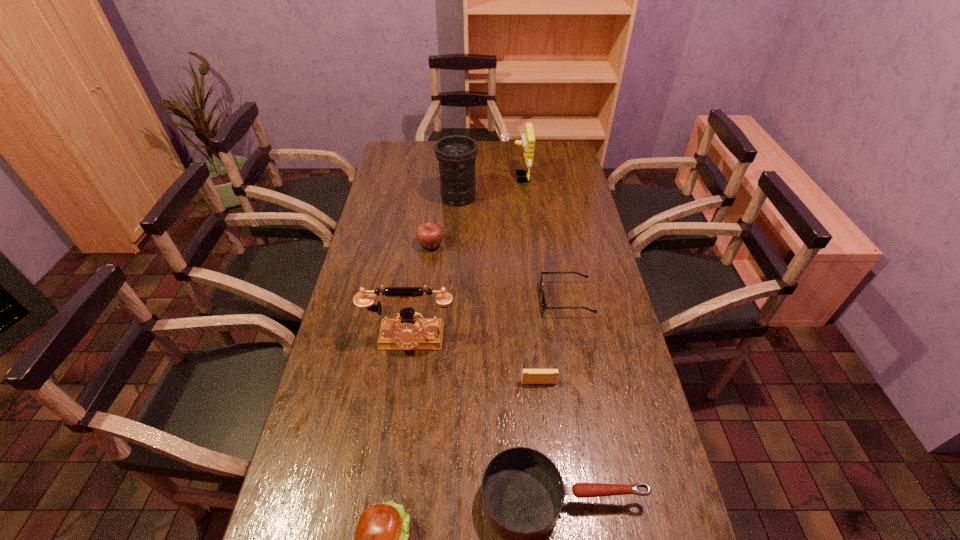
At what (x,y) coordinates should I click in order to perform the action: click on telephoto lens. Please return your answer as a coordinate pair (x, y). Looking at the image, I should click on click(456, 154).

The image size is (960, 540). What are the coordinates of `sponge` in the screenshot? It's located at (528, 138).

This screenshot has height=540, width=960. I want to click on telephone, so click(x=406, y=333).

Image resolution: width=960 pixels, height=540 pixels. What are the coordinates of `the sixth nearest object` in the screenshot? It's located at (429, 235).

Identify the location of videotape. (529, 376).

The width and height of the screenshot is (960, 540). What are the coordinates of `the fourth farthest object` in the screenshot? It's located at (544, 305).

I want to click on vacant space located 0.210m on the right of the telephoto lens, so click(529, 197).

Locate an element on the screen. Image resolution: width=960 pixels, height=540 pixels. vacant space positioned 0.150m on the face of the sponge is located at coordinates (479, 178).

Identify the location of vacant area situated on the face of the sponge. (468, 178).

Image resolution: width=960 pixels, height=540 pixels. I want to click on vacant space positioned 0.130m on the face of the sponge, so click(x=483, y=178).